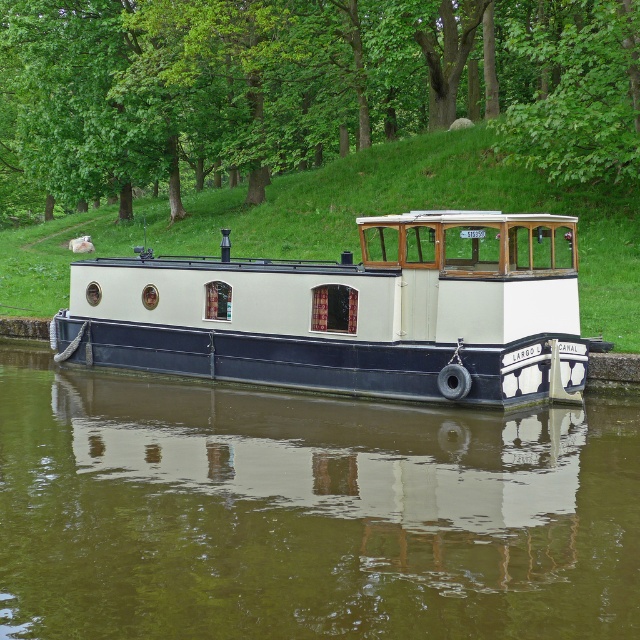
Is point (112, 433) positioned in front of point (356, 371)?

That is True.

Can you confirm if greenish water at center is positioned to the right of white matte boat at center?

Yes, greenish water at center is to the right of white matte boat at center.

Find the location of a particular element. Image resolution: width=640 pixels, height=640 pixels. greenish water at center is located at coordinates (307, 513).

Can you confirm if greenish water at center is positioned below green leafy tree at upper center?

Correct, greenish water at center is located below green leafy tree at upper center.

Who is positioned more to the right, greenish water at center or green leafy tree at upper center?

greenish water at center is more to the right.

Locate an element on the screen. The width and height of the screenshot is (640, 640). greenish water at center is located at coordinates (307, 513).

Can you confirm if green leafy tree at upper center is positioned to the left of white matte boat at center?

Yes, green leafy tree at upper center is to the left of white matte boat at center.

Can you confirm if green leafy tree at upper center is positioned below white matte boat at center?

No.

This screenshot has height=640, width=640. Identify the location of green leafy tree at upper center. (301, 86).